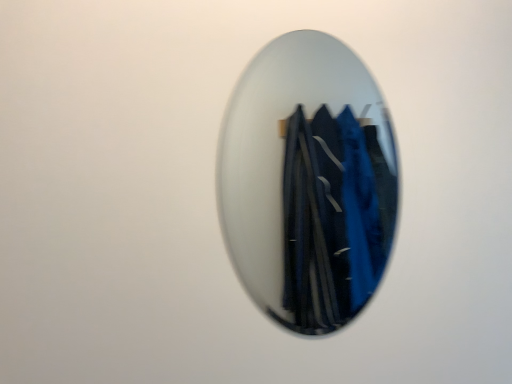
This screenshot has width=512, height=384. What do you see at coordinates (308, 182) in the screenshot? I see `blue fabric surfboard at center` at bounding box center [308, 182].

Based on the photo, what is the approximate width of blue fabric surfboard at center?

It is 0.63 inches.

This screenshot has height=384, width=512. What are the coordinates of `blue fabric surfboard at center` in the screenshot? It's located at (308, 182).

This screenshot has width=512, height=384. I want to click on blue fabric surfboard at center, so click(x=308, y=182).